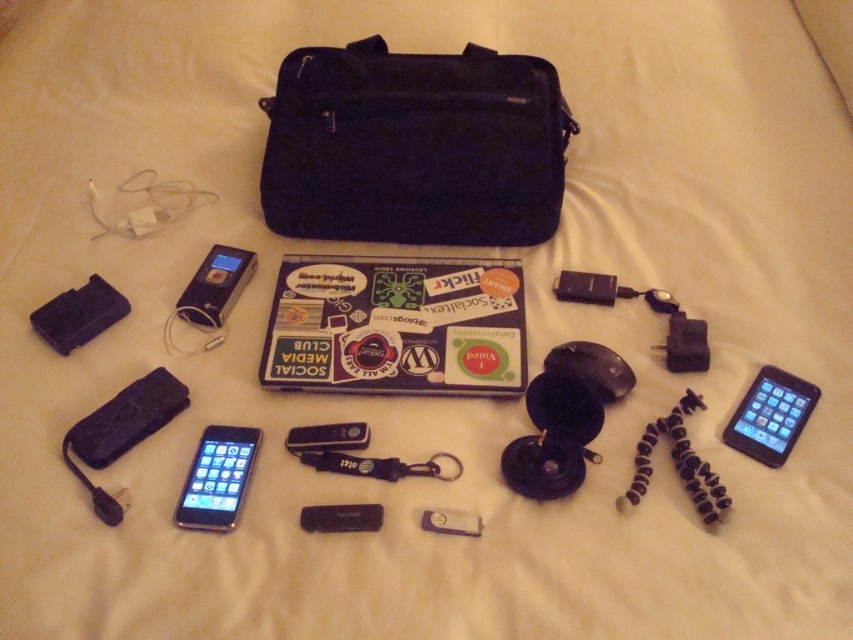
Question: Is dark blue fabric bag at center in front of black rubber keychain at center?

Choices:
 (A) no
 (B) yes

Answer: (A)

Question: Observing the image, what is the correct spatial positioning of black glossy ipod at lower left in reference to black rubber keychain at center?

Choices:
 (A) right
 (B) left

Answer: (B)

Question: Based on their relative distances, which object is nearer to the flexible black tripod at lower right?

Choices:
 (A) satin black mp3 player at center
 (B) dark blue fabric bag at center
 (C) black glossy ipod at lower left
 (D) black rubber keychain at center

Answer: (D)

Question: Which of the following is the farthest from the observer?

Choices:
 (A) (209, 308)
 (B) (537, 164)
 (C) (200, 524)
 (D) (329, 451)

Answer: (B)

Question: Is black glossy ipod at lower left above black rubber keychain at center?

Choices:
 (A) no
 (B) yes

Answer: (A)

Question: Which object appears farthest from the camera in this image?

Choices:
 (A) black rubber keychain at center
 (B) dark blue fabric bag at center

Answer: (B)